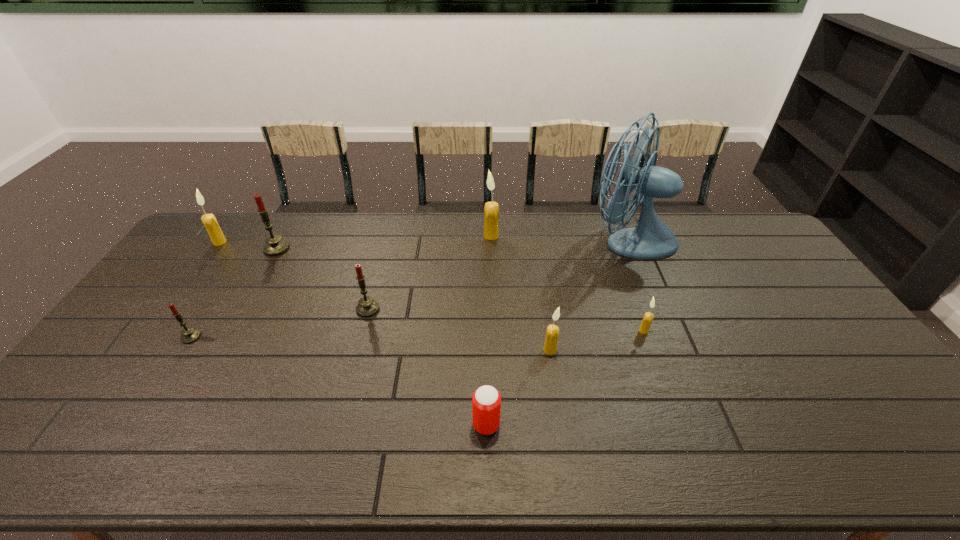
Point out which cream candle is positioned as the second nearest to the tallest candle. Please provide its 2D coordinates. Your answer should be formatted as a tuple, i.e. [(x, y)], where the tuple contains the x and y coordinates of a point satisfying the conditions above.

[(648, 317)]

You are a GUI agent. You are given a task and a screenshot of the screen. Output one action in this format:
    pyautogui.click(x=<x>, y=<y>)
    Task: Click on the cream candle identified as the third closest to the second smallest red candle
    
    Given the screenshot: What is the action you would take?
    pyautogui.click(x=217, y=237)

Where is `red candle that is the closest to the seventh object from left to right`? The width and height of the screenshot is (960, 540). red candle that is the closest to the seventh object from left to right is located at coordinates (367, 307).

Image resolution: width=960 pixels, height=540 pixels. I want to click on red candle object that ranks as the closest to the second object from left to right, so click(x=275, y=245).

The height and width of the screenshot is (540, 960). Identify the location of blank space that satisfies the following two spatial constraints: 1. on the back side of the eighth shortest object; 2. on the right side of the second biggest red candle. (387, 236).

Find the location of a particular element. This screenshot has width=960, height=540. vacant space that satisfies the following two spatial constraints: 1. in front of the tallest object to blow air; 2. on the front side of the second nearest red candle is located at coordinates (658, 309).